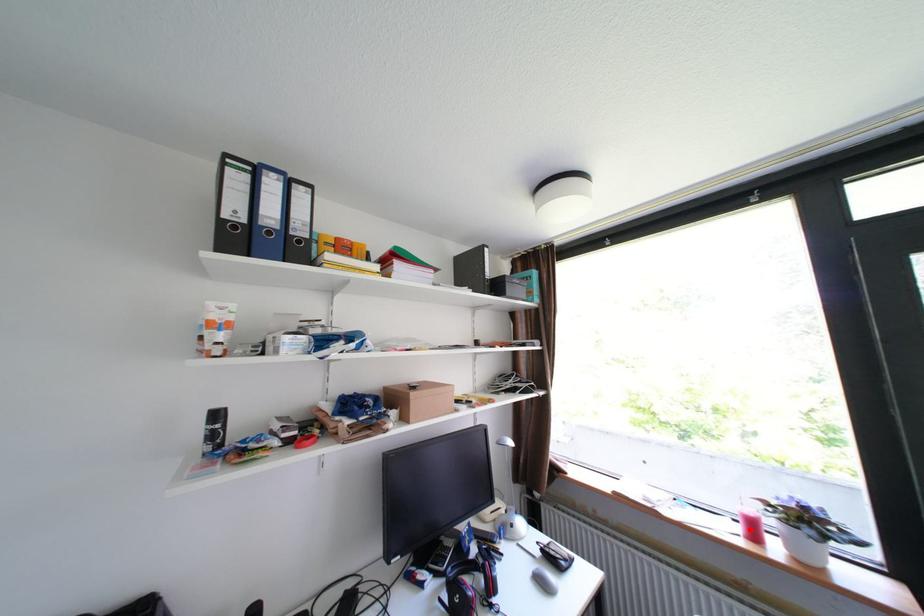
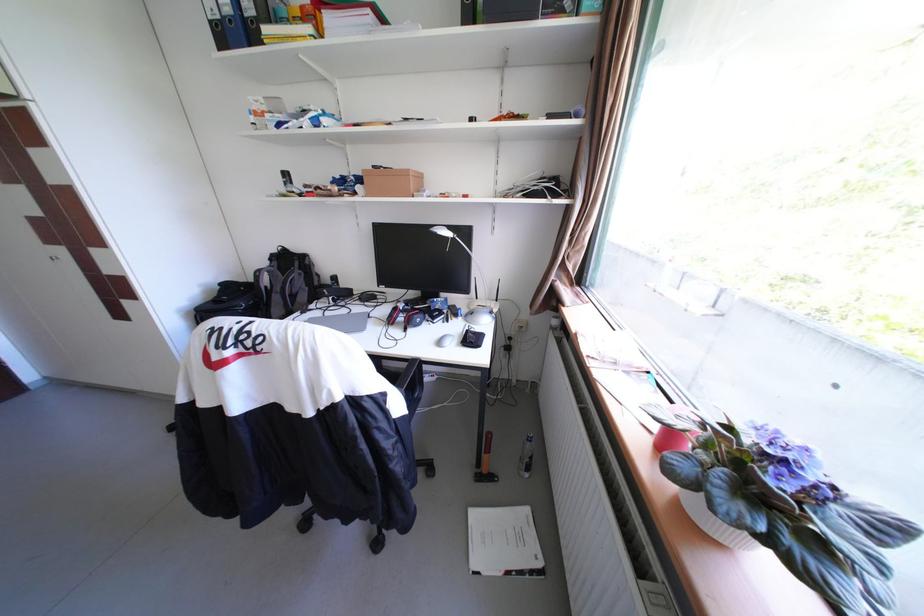
In the second image, find the point that corresponds to the highlighted location in the first image.

(666, 426)